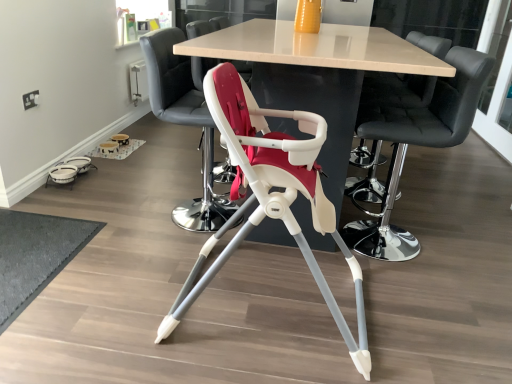
Question: From a real-world perspective, does dark gray textured mat at lower left sit lower than matte white highchair at center, which appears as the 2th chair when viewed from the left?

Choices:
 (A) yes
 (B) no

Answer: (A)

Question: Considering the relative sizes of dark gray textured mat at lower left and matte white highchair at center, acting as the 3th chair starting from the right, in the image provided, is dark gray textured mat at lower left wider than matte white highchair at center, acting as the 3th chair starting from the right,?

Choices:
 (A) no
 (B) yes

Answer: (A)

Question: Can you confirm if dark gray textured mat at lower left is smaller than matte white highchair at center, acting as the 3th chair starting from the right?

Choices:
 (A) no
 (B) yes

Answer: (B)

Question: Would you say dark gray textured mat at lower left is outside matte white highchair at center, acting as the 3th chair starting from the right?

Choices:
 (A) no
 (B) yes

Answer: (B)

Question: Is dark gray textured mat at lower left at the right side of matte white highchair at center, acting as the 3th chair starting from the right?

Choices:
 (A) no
 (B) yes

Answer: (A)

Question: Relative to white plastic highchair at center, the 4th chair positioned from the right, is transparent glass door at upper right in front or behind?

Choices:
 (A) front
 (B) behind

Answer: (B)

Question: Considering the positions of transparent glass door at upper right and white plastic highchair at center, the 4th chair positioned from the right, in the image, is transparent glass door at upper right wider or thinner than white plastic highchair at center, the 4th chair positioned from the right,?

Choices:
 (A) thin
 (B) wide

Answer: (A)

Question: From a real-world perspective, relative to white plastic highchair at center, the 4th chair positioned from the right, is transparent glass door at upper right vertically above or below?

Choices:
 (A) above
 (B) below

Answer: (A)

Question: Which is correct: transparent glass door at upper right is inside white plastic highchair at center, the 4th chair positioned from the right, or outside of it?

Choices:
 (A) outside
 (B) inside

Answer: (A)

Question: In terms of width, does dark gray textured mat at lower left look wider or thinner when compared to white plastic highchair at center, the 4th chair positioned from the right?

Choices:
 (A) wide
 (B) thin

Answer: (A)

Question: Considering the positions of point (56, 233) and point (155, 82), is point (56, 233) closer or farther from the camera than point (155, 82)?

Choices:
 (A) closer
 (B) farther

Answer: (B)

Question: Relative to white plastic highchair at center, positioned as the first chair in left-to-right order, is dark gray textured mat at lower left in front or behind?

Choices:
 (A) behind
 (B) front

Answer: (B)

Question: From the image's perspective, is dark gray textured mat at lower left located above or below white plastic highchair at center, positioned as the first chair in left-to-right order?

Choices:
 (A) below
 (B) above

Answer: (A)

Question: In the image, is smooth black bar stool at center, marked as the 4th chair in a left-to-right arrangement, positioned in front of or behind matte white table at center?

Choices:
 (A) behind
 (B) front

Answer: (A)

Question: From a real-world perspective, is smooth black bar stool at center, marked as the 4th chair in a left-to-right arrangement, positioned above or below matte white table at center?

Choices:
 (A) below
 (B) above

Answer: (B)